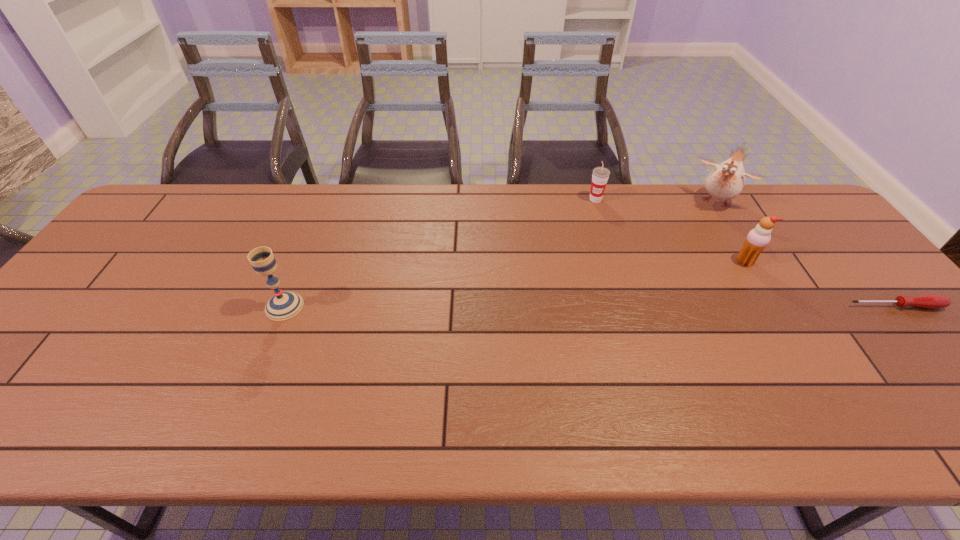
You are a GUI agent. You are given a task and a screenshot of the screen. Output one action in this format:
    pyautogui.click(x=<x>, y=<y>)
    Task: Click on the blank region between the bird and the rightmost object
    The image size is (960, 540).
    Given the screenshot: What is the action you would take?
    pyautogui.click(x=806, y=254)

Locate an element on the screen. free space between the rightmost object and the bird is located at coordinates (806, 254).

This screenshot has width=960, height=540. I want to click on vacant point located between the leftmost object and the fourth tallest object, so click(x=440, y=253).

In order to click on vacant space that is in between the icecream and the bird in this screenshot , I will do `click(732, 232)`.

Locate an element on the screen. unoccupied area between the chalice and the second object from left to right is located at coordinates (440, 253).

I want to click on free spot between the bird and the second shortest object, so click(x=657, y=200).

I want to click on free space between the leftmost object and the second shortest object, so click(x=440, y=253).

Identify which object is the closest to the second object from left to right. Please provide its 2D coordinates. Your answer should be formatted as a tuple, i.e. [(x, y)], where the tuple contains the x and y coordinates of a point satisfying the conditions above.

[(726, 181)]

Locate which object ranks in proximity to the bird. Please provide its 2D coordinates. Your answer should be formatted as a tuple, i.e. [(x, y)], where the tuple contains the x and y coordinates of a point satisfying the conditions above.

[(758, 238)]

Where is `vacant point that satisfies the following two spatial constraints: 1. on the back side of the bird; 2. on the left side of the third nearest object`? The height and width of the screenshot is (540, 960). vacant point that satisfies the following two spatial constraints: 1. on the back side of the bird; 2. on the left side of the third nearest object is located at coordinates (708, 201).